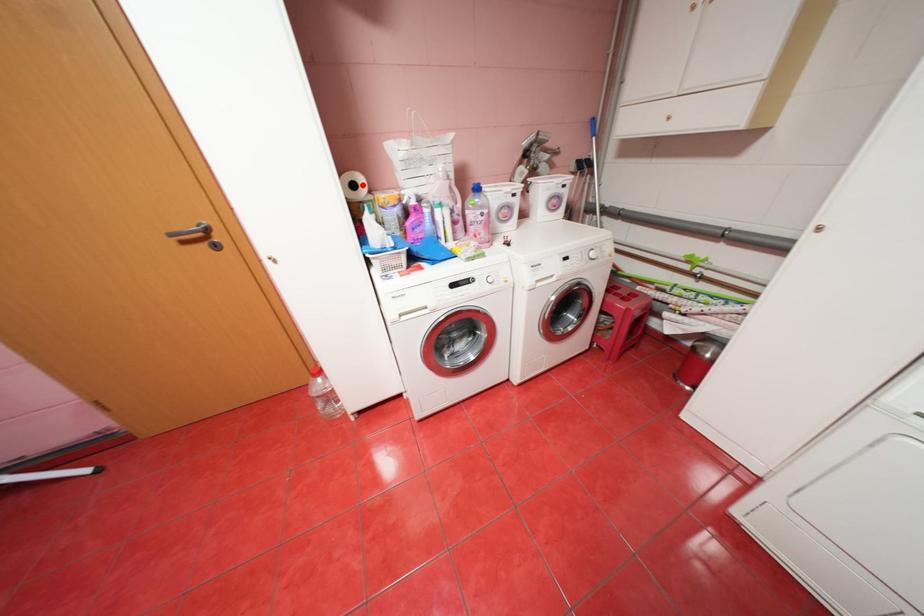
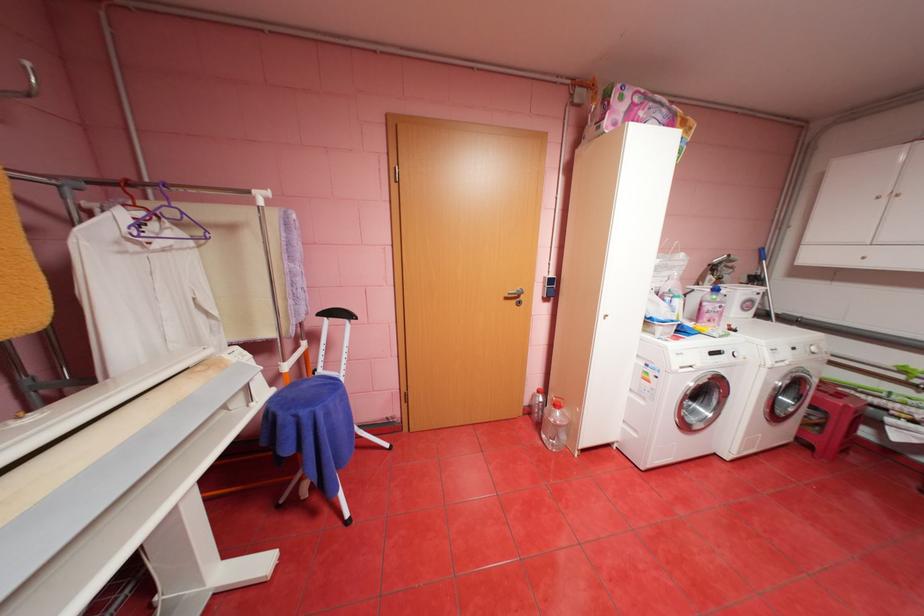
Question: I am providing you with two images of the same scene from different viewpoints. A red point is marked on the first image. At the location where the point appears in image 1, is it still visible in image 2?

Choices:
 (A) Yes
 (B) No

Answer: (B)